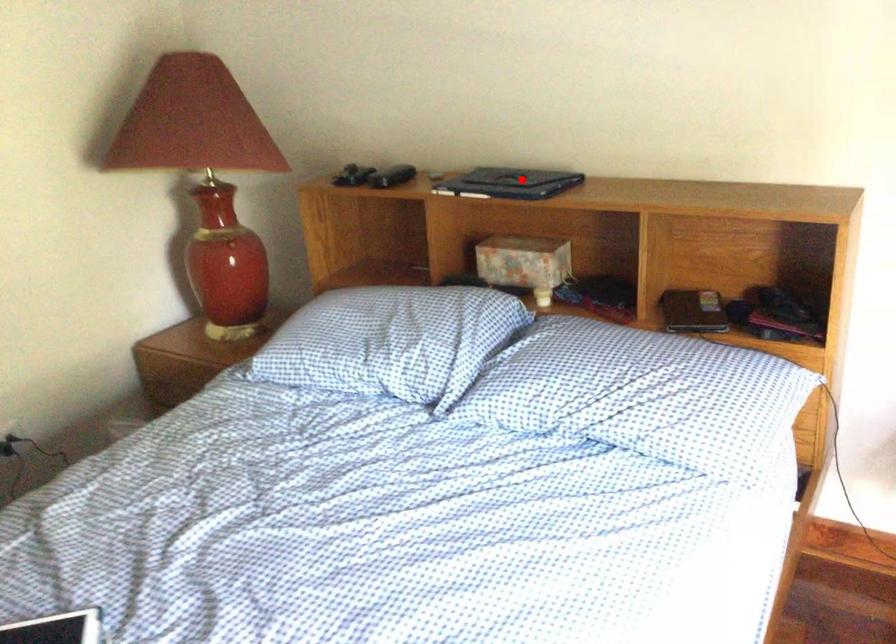
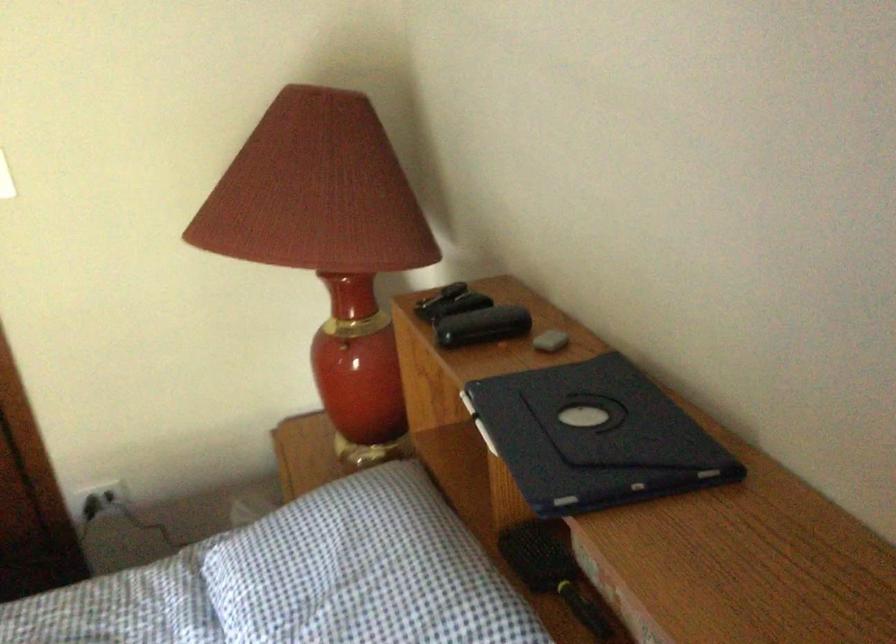
Question: I am providing you with two images of the same scene from different viewpoints. Given a red point in image1, look at the same physical point in image2. Is it:

Choices:
 (A) Closer to the viewpoint
 (B) Farther from the viewpoint

Answer: (A)